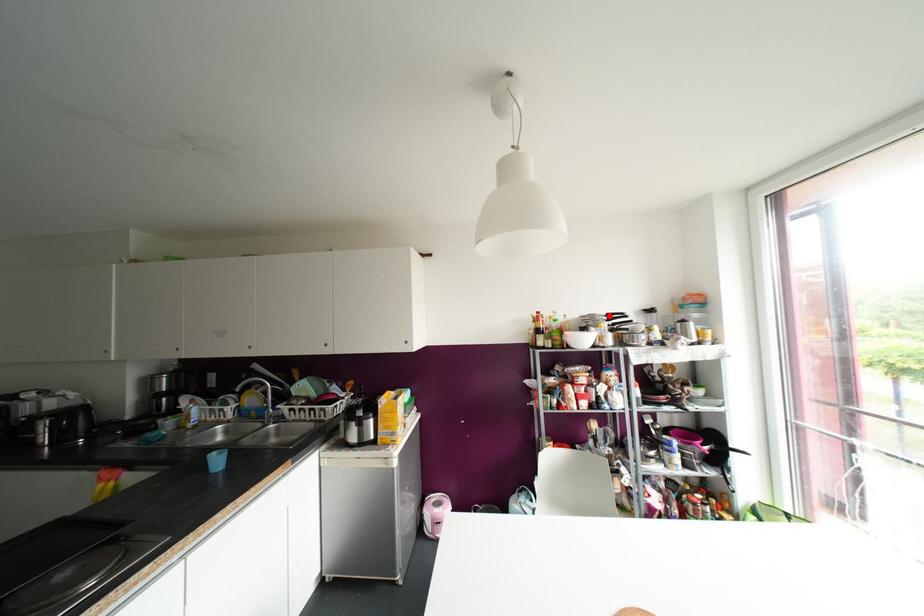
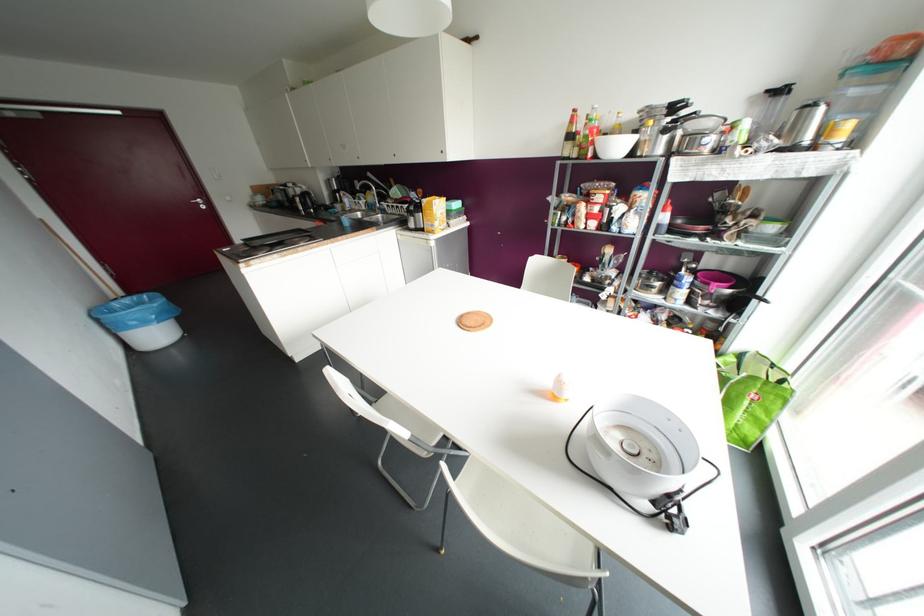
Locate, in the second image, the point that corresponds to the highlighted location in the first image.

(673, 107)